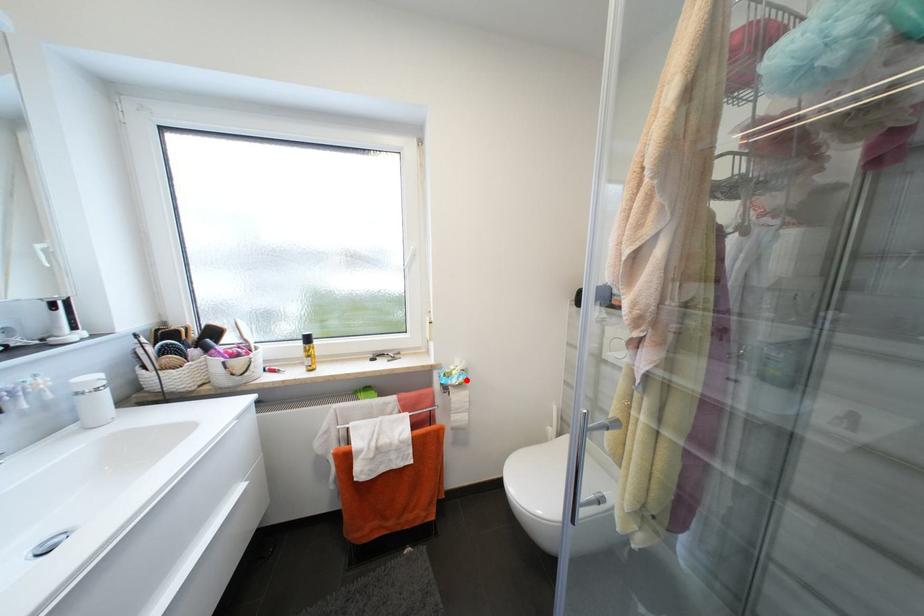
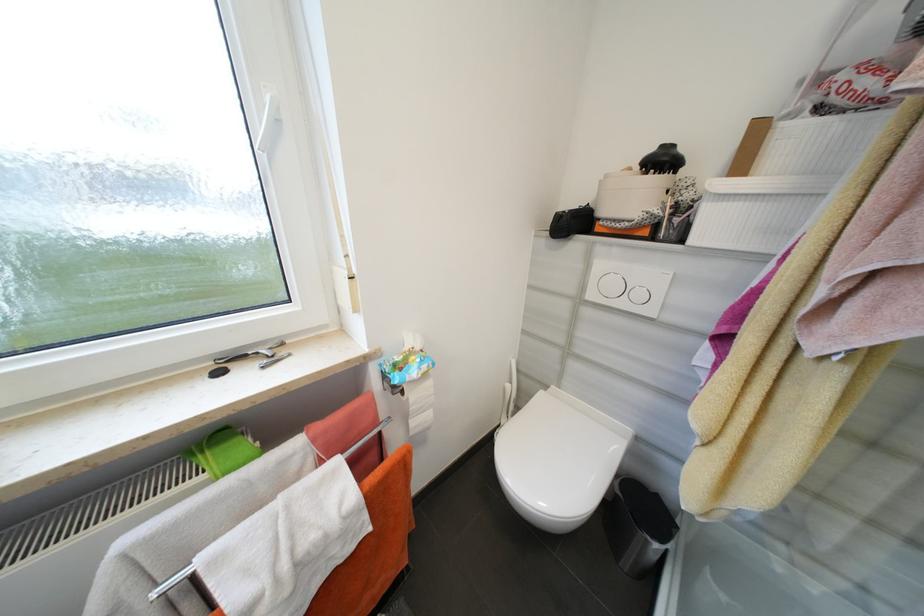
Locate, in the second image, the point that corresponds to the highlighted location in the first image.

(430, 368)